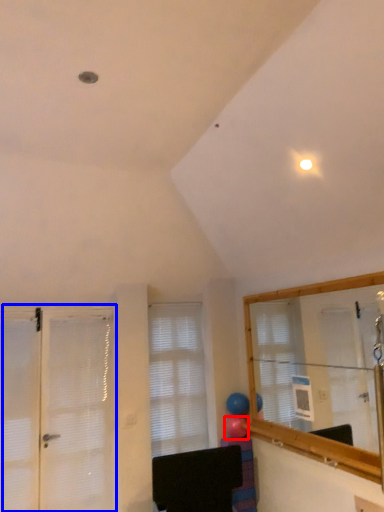
Question: Among these objects, which one is farthest to the camera, balloon (highlighted by a red box) or door (highlighted by a blue box)?

Choices:
 (A) balloon
 (B) door

Answer: (A)